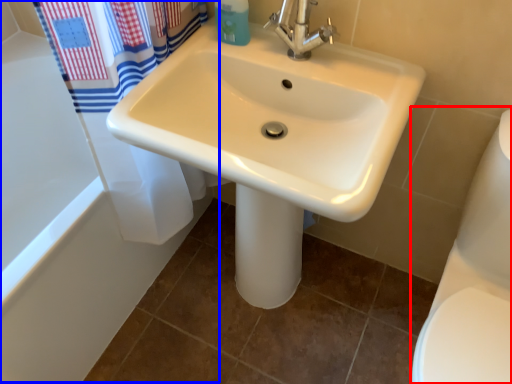
Question: Which of the following is the farthest to the observer, toilet bowl (highlighted by a red box) or bath (highlighted by a blue box)?

Choices:
 (A) toilet bowl
 (B) bath

Answer: (B)